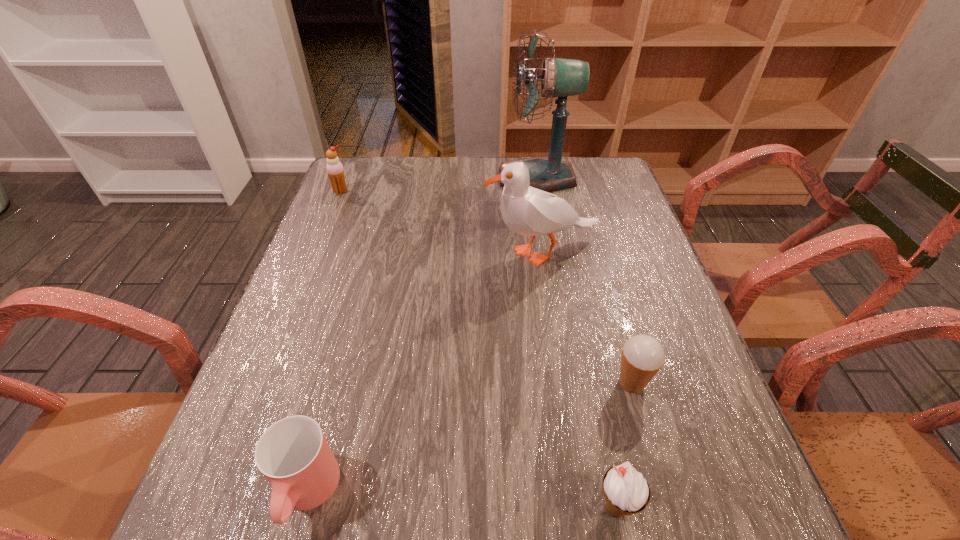
This screenshot has width=960, height=540. I want to click on vacant space located in front of the tallest object where the wind blows, so click(418, 178).

Image resolution: width=960 pixels, height=540 pixels. What are the coordinates of `free location located at the beak of the second tallest object` in the screenshot? It's located at (386, 253).

Where is `blank space located at the beak of the second tallest object`? This screenshot has width=960, height=540. blank space located at the beak of the second tallest object is located at coordinates (397, 253).

Locate an element on the screen. blank area located 0.320m at the beak of the second tallest object is located at coordinates (359, 253).

Image resolution: width=960 pixels, height=540 pixels. I want to click on blank space located 0.270m at the front with a straw on the leftmost object, so pyautogui.click(x=314, y=255).

Locate an element on the screen. The image size is (960, 540). blank area located on the left of the fourth farthest object is located at coordinates (535, 383).

Find the location of `vacant space situated 0.160m on the right of the nearest icecream`. vacant space situated 0.160m on the right of the nearest icecream is located at coordinates click(739, 507).

Locate an element on the screen. Image resolution: width=960 pixels, height=540 pixels. fan that is at the far edge is located at coordinates (561, 78).

Where is `icecream that is at the far edge`? The width and height of the screenshot is (960, 540). icecream that is at the far edge is located at coordinates (335, 171).

Where is `object that is at the near edge`? This screenshot has height=540, width=960. object that is at the near edge is located at coordinates (623, 486).